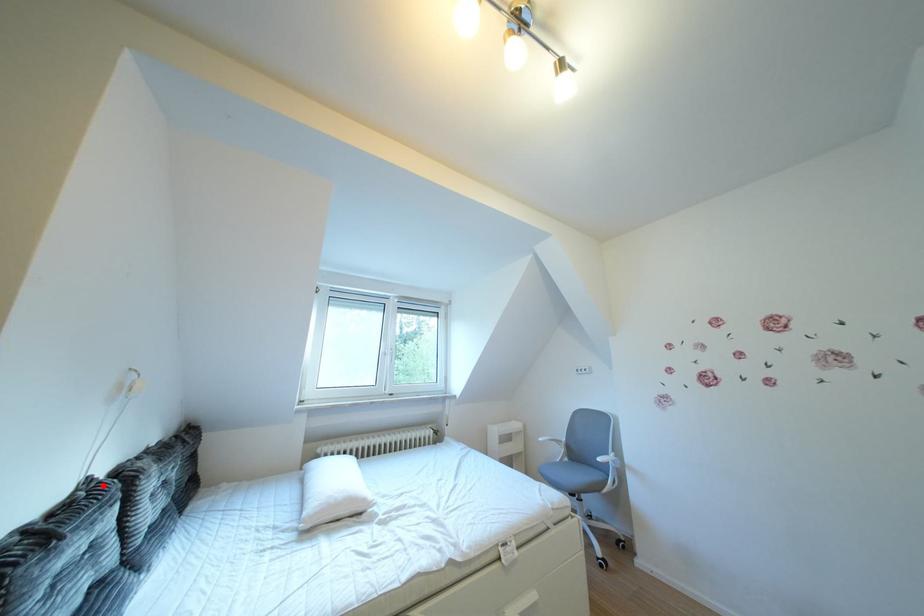
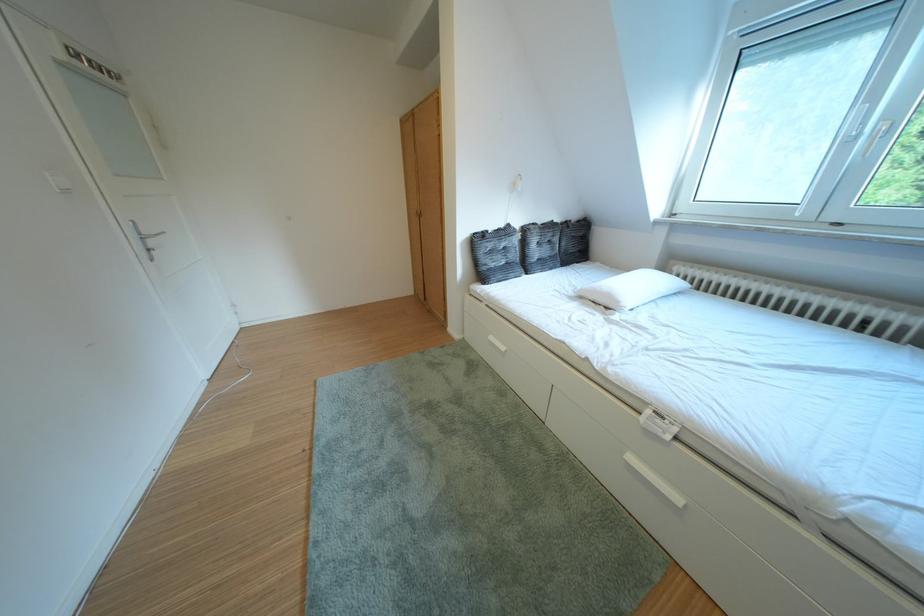
Question: I am providing you with two images of the same scene from different viewpoints. Image1 has a red point marked. In image2, the corresponding 3D location appears at what relative position? Reply with the corresponding letter.

Choices:
 (A) Closer
 (B) Farther

Answer: (A)